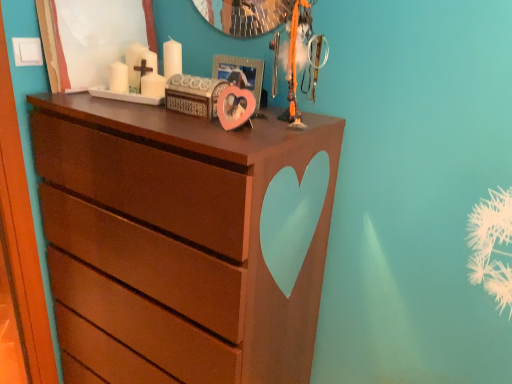
The width and height of the screenshot is (512, 384). Describe the element at coordinates (240, 73) in the screenshot. I see `pink matte heart at center` at that location.

Locate an element on the screen. pink matte heart at center is located at coordinates (240, 73).

Measure the distance between brown matte chest of drawers at center and camera.

They are 86.13 centimeters apart.

Locate an element on the screen. brown matte chest of drawers at center is located at coordinates (175, 242).

This screenshot has width=512, height=384. What do you see at coordinates (175, 242) in the screenshot?
I see `brown matte chest of drawers at center` at bounding box center [175, 242].

Identify the location of pink matte heart at center. (240, 73).

Which is more to the left, brown matte chest of drawers at center or pink matte heart at center?

brown matte chest of drawers at center is more to the left.

Considering their positions, is brown matte chest of drawers at center located in front of or behind pink matte heart at center?

Clearly, brown matte chest of drawers at center is in front of pink matte heart at center.

Considering the points (225, 301) and (260, 92), which point is behind, point (225, 301) or point (260, 92)?

Point (260, 92)

From the image's perspective, is brown matte chest of drawers at center positioned above or below pink matte heart at center?

From the image's perspective, brown matte chest of drawers at center appears below pink matte heart at center.

In the scene shown: From a real-world perspective, which object rests below the other?

In real-world perspective, brown matte chest of drawers at center is lower.

Between brown matte chest of drawers at center and pink matte heart at center, which one has smaller width?

pink matte heart at center is thinner.

Who is taller, brown matte chest of drawers at center or pink matte heart at center?

With more height is brown matte chest of drawers at center.

Which of these two, brown matte chest of drawers at center or pink matte heart at center, is smaller?

Smaller between the two is pink matte heart at center.

Is brown matte chest of drawers at center inside or outside of pink matte heart at center?

brown matte chest of drawers at center is not enclosed by pink matte heart at center.

In the scene shown: Is there a large distance between brown matte chest of drawers at center and pink matte heart at center?

No, brown matte chest of drawers at center is in close proximity to pink matte heart at center.

Is brown matte chest of drawers at center facing towards pink matte heart at center?

No.

How many degrees apart are the facing directions of brown matte chest of drawers at center and pink matte heart at center?

The facing directions of brown matte chest of drawers at center and pink matte heart at center are 2.01 degrees apart.

The height and width of the screenshot is (384, 512). Identify the location of picture frame that is behind the brown matte chest of drawers at center. (240, 73).

Is pink matte heart at center at the right side of brown matte chest of drawers at center?

Indeed, pink matte heart at center is positioned on the right side of brown matte chest of drawers at center.

In the scene shown: Is the position of pink matte heart at center less distant than that of brown matte chest of drawers at center?

No, the depth of pink matte heart at center is greater than that of brown matte chest of drawers at center.

Does point (214, 55) lie in front of point (254, 136)?

No.

From the image's perspective, would you say pink matte heart at center is shown under brown matte chest of drawers at center?

No, from the image's perspective, pink matte heart at center is not below brown matte chest of drawers at center.

From a real-world perspective, is pink matte heart at center positioned under brown matte chest of drawers at center based on gravity?

No, from a real-world perspective, pink matte heart at center is not beneath brown matte chest of drawers at center.

Considering the sizes of objects pink matte heart at center and brown matte chest of drawers at center in the image provided, who is thinner, pink matte heart at center or brown matte chest of drawers at center?

Thinner between the two is pink matte heart at center.

Who is taller, pink matte heart at center or brown matte chest of drawers at center?

brown matte chest of drawers at center.

Who is smaller, pink matte heart at center or brown matte chest of drawers at center?

With smaller size is pink matte heart at center.

Choose the correct answer: Is pink matte heart at center inside brown matte chest of drawers at center or outside it?

pink matte heart at center exists outside the volume of brown matte chest of drawers at center.

Is the surface of pink matte heart at center in direct contact with brown matte chest of drawers at center?

No, pink matte heart at center is not next to brown matte chest of drawers at center.

Is pink matte heart at center oriented towards brown matte chest of drawers at center?

No.

How much distance is there between pink matte heart at center and brown matte chest of drawers at center?

20.21 inches.

The image size is (512, 384). What are the coordinates of `chest of drawers below the pink matte heart at center (from the image's perspective)` in the screenshot? It's located at (175, 242).

The width and height of the screenshot is (512, 384). I want to click on picture frame above the brown matte chest of drawers at center (from the image's perspective), so click(x=240, y=73).

At what (x,y) coordinates should I click in order to perform the action: click on picture frame located on the right of brown matte chest of drawers at center. Please return your answer as a coordinate pair (x, y). The height and width of the screenshot is (384, 512). Looking at the image, I should click on (240, 73).